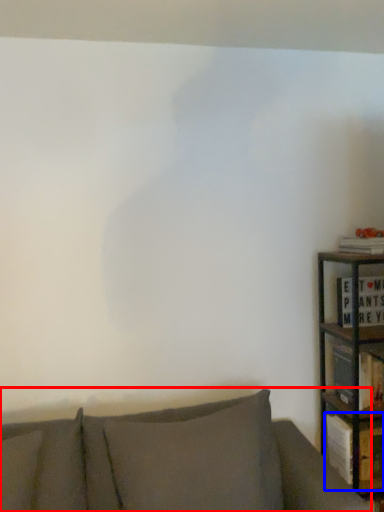
Question: Which of the following is the closest to the observer, studio couch (highlighted by a red box) or book (highlighted by a blue box)?

Choices:
 (A) studio couch
 (B) book

Answer: (A)